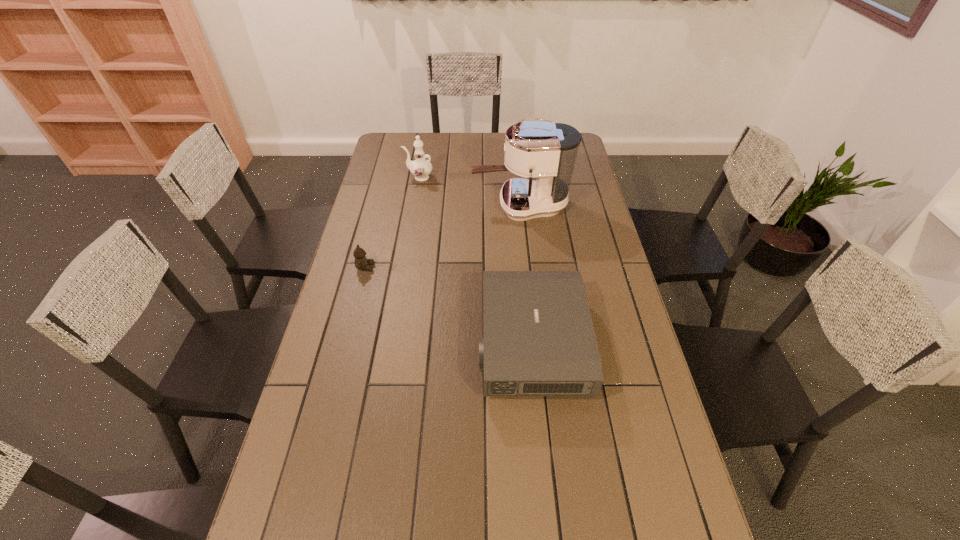
Find the location of a particular element. The image size is (960, 540). free space that is in between the third farthest object and the third object from right to left is located at coordinates (393, 222).

Select which object is the closest to the leftmost object. Please provide its 2D coordinates. Your answer should be formatted as a tuple, i.e. [(x, y)], where the tuple contains the x and y coordinates of a point satisfying the conditions above.

[(538, 339)]

Select which object is the second closest to the nearest object. Please provide its 2D coordinates. Your answer should be formatted as a tuple, i.e. [(x, y)], where the tuple contains the x and y coordinates of a point satisfying the conditions above.

[(361, 262)]